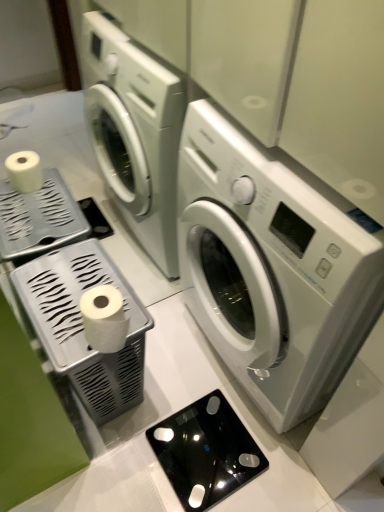
Identify the location of empty space that is ontop of black glass scale at lower center, placed as the 2th appliance when sorted from left to right (from a real-world perspective). The image size is (384, 512). (211, 443).